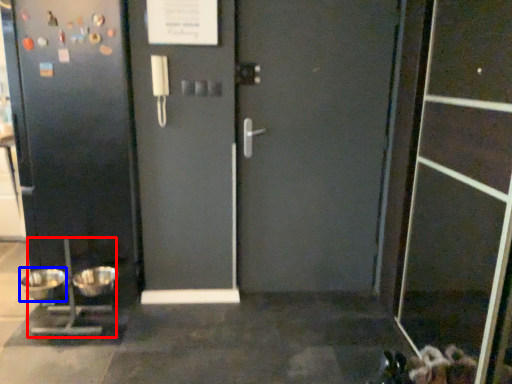
Question: Which object appears closest to the camera in this image, appliance (highlighted by a red box) or mixing bowl (highlighted by a blue box)?

Choices:
 (A) appliance
 (B) mixing bowl

Answer: (A)